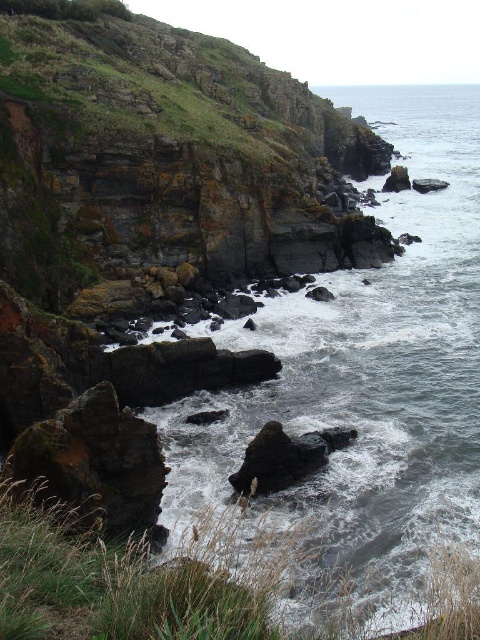
You are a geologist studying the coastal erosion patterns in this area. You observe the gray rocky water at center and the smooth dark rock at center. Which object is located above the other?

The gray rocky water at center is positioned over smooth dark rock at center, meaning the water is above the rock.

You are a photographer standing at the edge of the cliff, aiming to capture the gray rocky water at center and the smooth dark rock at center in the same frame. Which object should you adjust your camera to focus on first if you want to include both in your shot?

The gray rocky water at center is positioned on the right side of smooth dark rock at center, so you should focus on the smooth dark rock at center first to ensure both objects are captured in the frame.